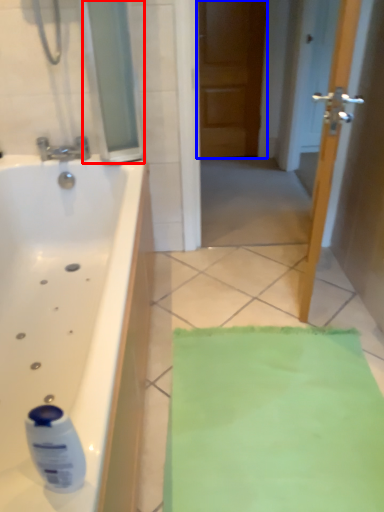
Question: Among these objects, which one is nearest to the camera, glass door (highlighted by a red box) or door (highlighted by a blue box)?

Choices:
 (A) glass door
 (B) door

Answer: (A)